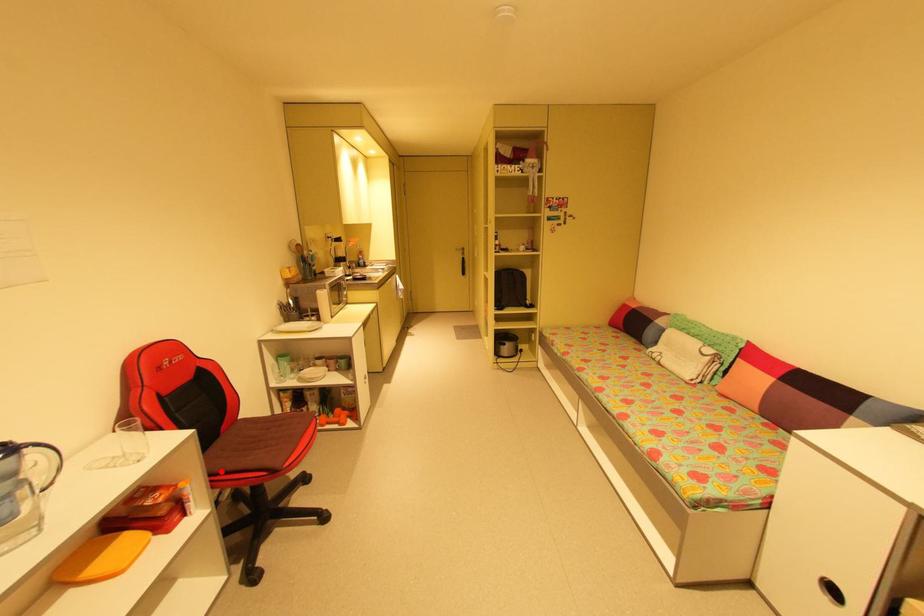
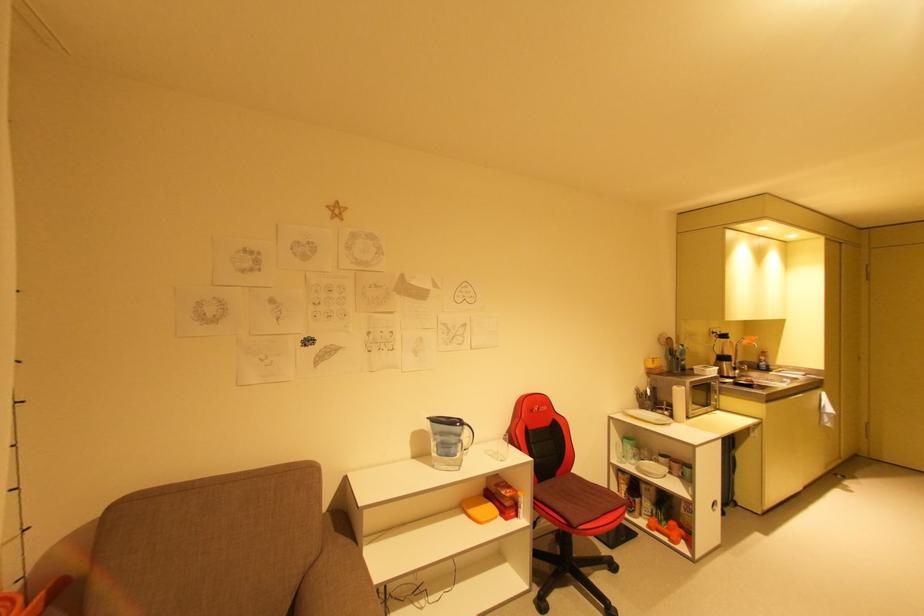
In the second image, find the point that corresponds to the highlighted location in the first image.

(544, 498)